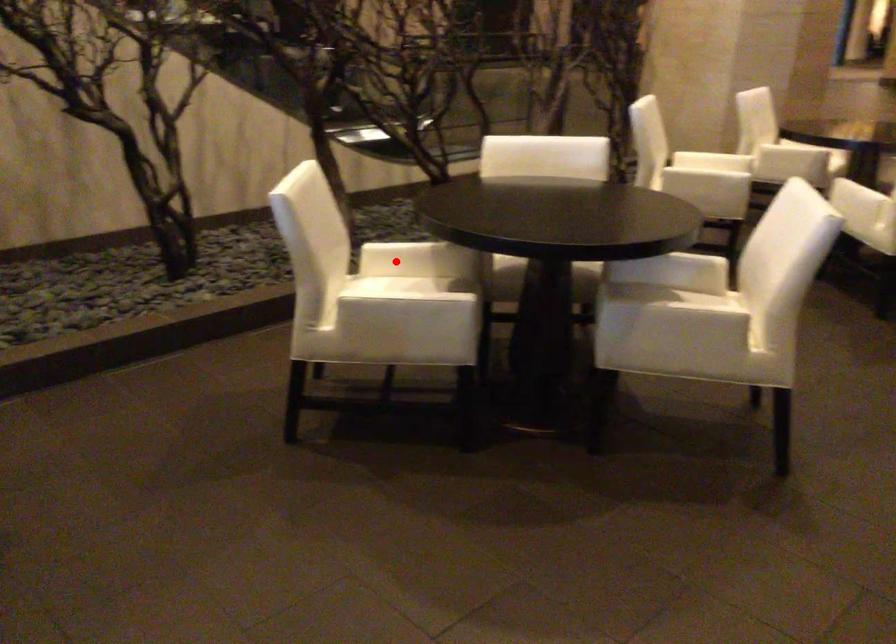
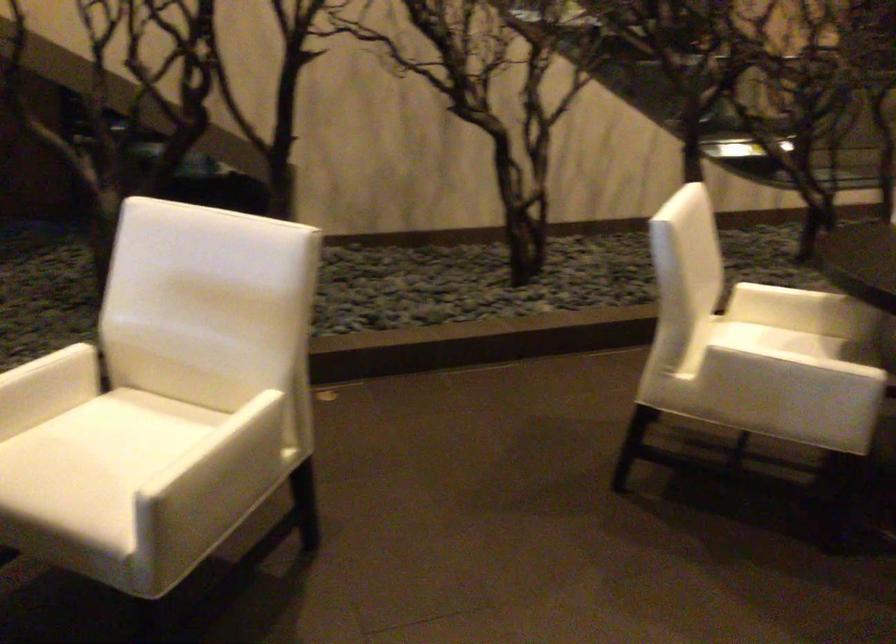
Question: I am providing you with two images of the same scene from different viewpoints. Given a red point in image1, look at the same physical point in image2. Is it:

Choices:
 (A) Closer to the viewpoint
 (B) Farther from the viewpoint

Answer: (A)